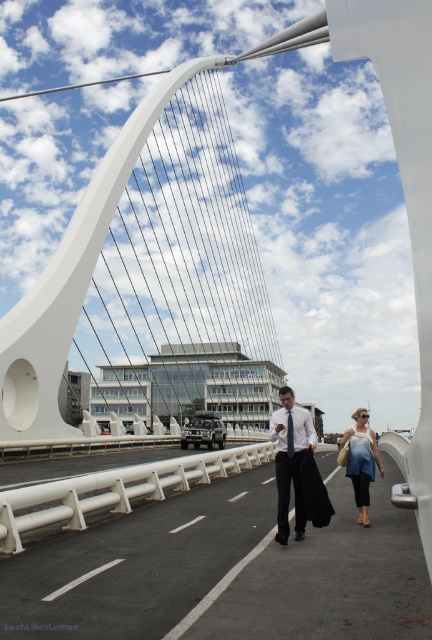
Question: Can you confirm if white shirt with tie at center is positioned above blue denim jacket at lower right?

Choices:
 (A) no
 (B) yes

Answer: (B)

Question: Which of the following is the farthest from the observer?

Choices:
 (A) 365,436
 (B) 289,500

Answer: (A)

Question: Does white shirt with tie at center appear on the right side of blue denim jacket at lower right?

Choices:
 (A) yes
 (B) no

Answer: (B)

Question: Which point is closer to the camera taking this photo?

Choices:
 (A) (367, 465)
 (B) (286, 401)

Answer: (B)

Question: Can you confirm if white shirt with tie at center is bigger than blue denim jacket at lower right?

Choices:
 (A) yes
 (B) no

Answer: (B)